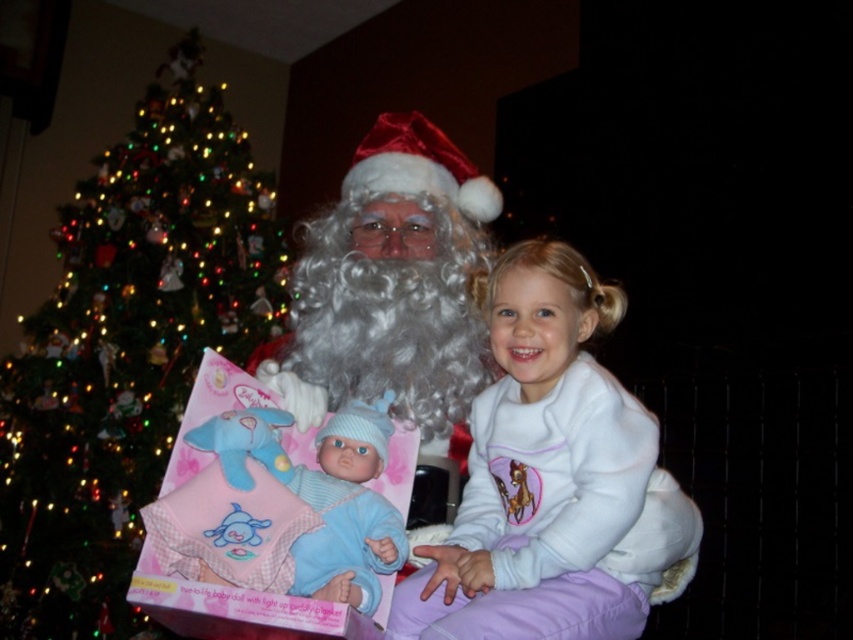
Question: Observing the image, what is the correct spatial positioning of white fleece at center in reference to blue plush baby doll at center?

Choices:
 (A) left
 (B) right

Answer: (B)

Question: Estimate the real-world distances between objects in this image. Which object is farther from the white fleece at center?

Choices:
 (A) green matte christmas tree at left
 (B) white fluffy santa at center

Answer: (A)

Question: In this image, where is white fluffy santa at center located relative to blue plush baby doll at center?

Choices:
 (A) below
 (B) above

Answer: (B)

Question: Which of the following is the farthest from the observer?

Choices:
 (A) (379, 380)
 (B) (599, 312)

Answer: (A)

Question: Which object appears closest to the camera in this image?

Choices:
 (A) white fluffy santa at center
 (B) blue plush baby doll at center

Answer: (B)

Question: From the image, what is the correct spatial relationship of green matte christmas tree at left in relation to white fluffy santa at center?

Choices:
 (A) above
 (B) below

Answer: (A)